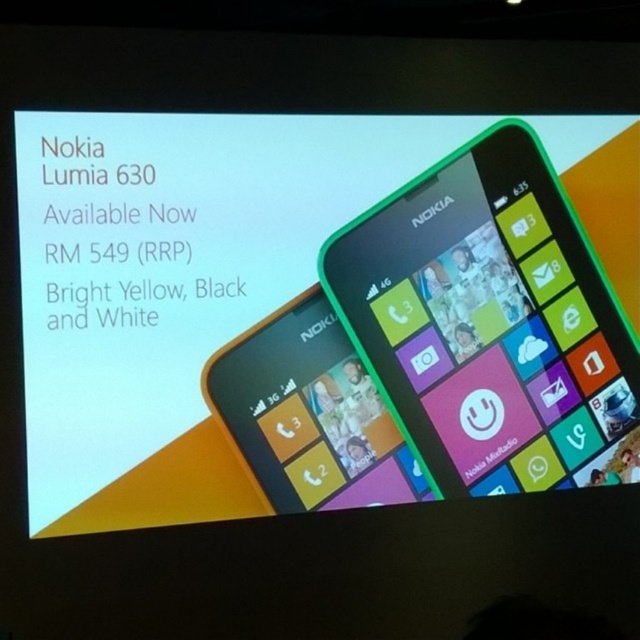
You are a customer looking at the advertisement for the Nokia Lumia 630. You see the bright yellow plastic nokia lumia 630 at upper right and the green plastic nokia lumia 630 at right. Which phone is closer to you?

The bright yellow plastic nokia lumia 630 at upper right is closer to you because it is in front of the green plastic nokia lumia 630 at right.

You are standing in front of the Nokia Lumia 630 advertisement. You want to touch the bright yellow plastic nokia lumia 630 at upper right with your hand, which is 1.5 feet long from your shoulder. Can you reach it?

The bright yellow plastic nokia lumia 630 at upper right is 7.43 feet away from the viewer. Since your hand is only 1.5 feet long from your shoulder, you cannot reach it.